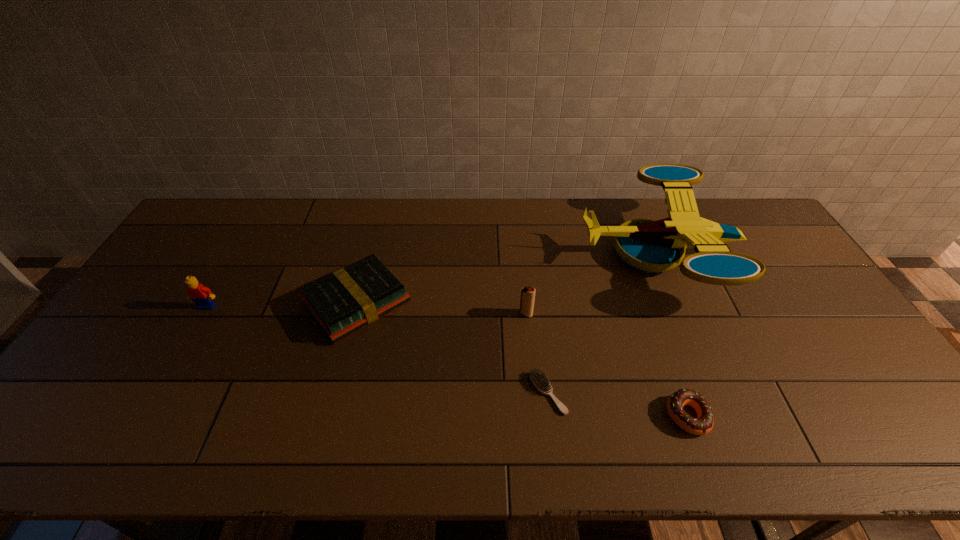
This screenshot has width=960, height=540. Find the location of `vacant space at the far left corner of the desktop`. vacant space at the far left corner of the desktop is located at coordinates (244, 213).

The width and height of the screenshot is (960, 540). Identify the location of vacant space at the far right corner of the desktop. (749, 207).

The image size is (960, 540). Find the location of `blank region between the hardback book and the tallest object`. blank region between the hardback book and the tallest object is located at coordinates tap(508, 278).

What are the coordinates of `vacant space in between the tallest object and the igniter` in the screenshot? It's located at (592, 283).

Where is `free point between the igniter and the fourth tallest object`? The height and width of the screenshot is (540, 960). free point between the igniter and the fourth tallest object is located at coordinates (442, 308).

Find the location of `vacant point located between the shortest object and the doughnut`. vacant point located between the shortest object and the doughnut is located at coordinates (617, 404).

This screenshot has height=540, width=960. Identify the location of free spot between the igniter and the fifth tallest object. (607, 364).

You are a GUI agent. You are given a task and a screenshot of the screen. Output one action in this format:
    pyautogui.click(x=<x>, y=<y>)
    Task: Click on the unoccupied area between the shortest object and the doughnut
    
    Given the screenshot: What is the action you would take?
    pyautogui.click(x=617, y=404)

The image size is (960, 540). Find the location of `free space between the igniter and the second object from left to right`. free space between the igniter and the second object from left to right is located at coordinates (442, 308).

Identify the location of unoccupied area between the fifth tallest object and the drone. (672, 334).